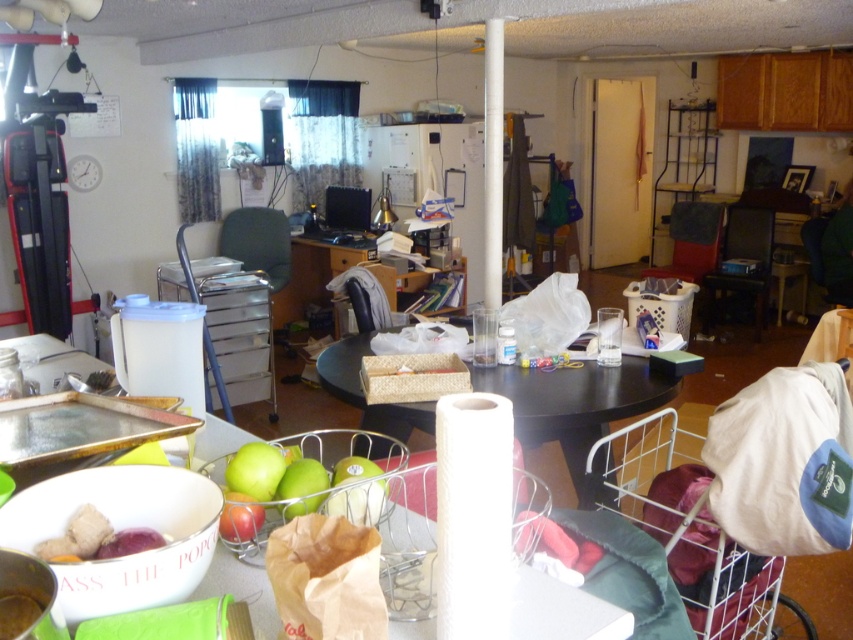
Does point (578, 502) come in front of point (100, 550)?

No, (578, 502) is behind (100, 550).

Based on the photo, can you confirm if black matte table at center is positioned above smooth purple potato at lower left?

No, black matte table at center is not above smooth purple potato at lower left.

Who is more forward, (554, 400) or (86, 538)?

Point (86, 538) is more forward.

Where is `black matte table at center`? black matte table at center is located at coordinates (575, 406).